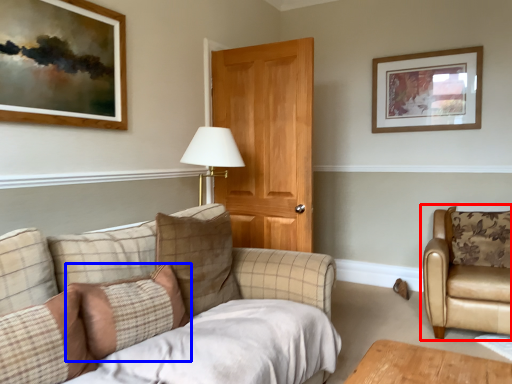
Question: Which object is further to the camera taking this photo, chair (highlighted by a red box) or pillow (highlighted by a blue box)?

Choices:
 (A) chair
 (B) pillow

Answer: (A)